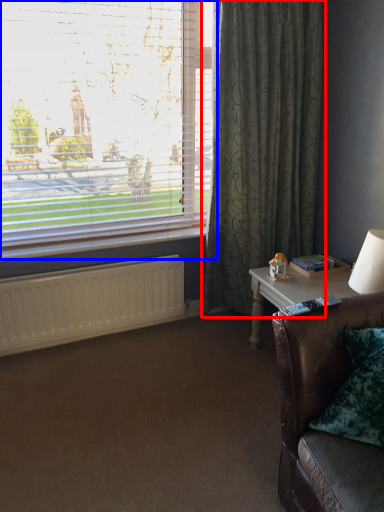
Question: Which object appears closest to the camera in this image, curtain (highlighted by a red box) or window (highlighted by a blue box)?

Choices:
 (A) curtain
 (B) window

Answer: (B)